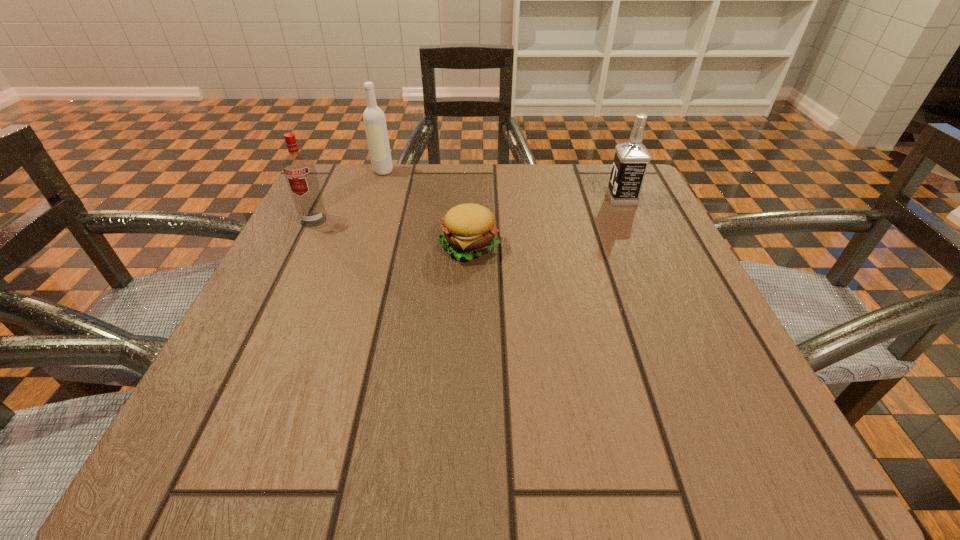
At what (x,y) coordinates should I click in order to perform the action: click on free point located 0.150m on the front label of the second farthest object. Please return your answer as a coordinate pair (x, y). This screenshot has width=960, height=540. Looking at the image, I should click on (540, 199).

Find the location of a particular element. The image size is (960, 540). vacant position located 0.220m on the front label of the second farthest object is located at coordinates (507, 199).

Locate an element on the screen. vacant space situated 0.050m on the front label of the nearest vodka is located at coordinates (302, 244).

The height and width of the screenshot is (540, 960). What are the coordinates of `free spot located on the back of the hamburger` in the screenshot? It's located at (471, 167).

Image resolution: width=960 pixels, height=540 pixels. Identify the location of object positioned at the right edge. (631, 159).

Identify the location of object at the far right corner. The height and width of the screenshot is (540, 960). (631, 159).

This screenshot has width=960, height=540. I want to click on vacant position at the far edge of the desktop, so click(442, 164).

The image size is (960, 540). I want to click on vacant space at the near edge, so click(487, 459).

You are a GUI agent. You are given a task and a screenshot of the screen. Output one action in this format:
    pyautogui.click(x=<x>, y=<y>)
    Task: Click on the vacant space at the left edge
    The height and width of the screenshot is (540, 960).
    Given the screenshot: What is the action you would take?
    pyautogui.click(x=214, y=404)

Locate an element on the screen. The image size is (960, 540). vacant region at the right edge of the desktop is located at coordinates (728, 352).